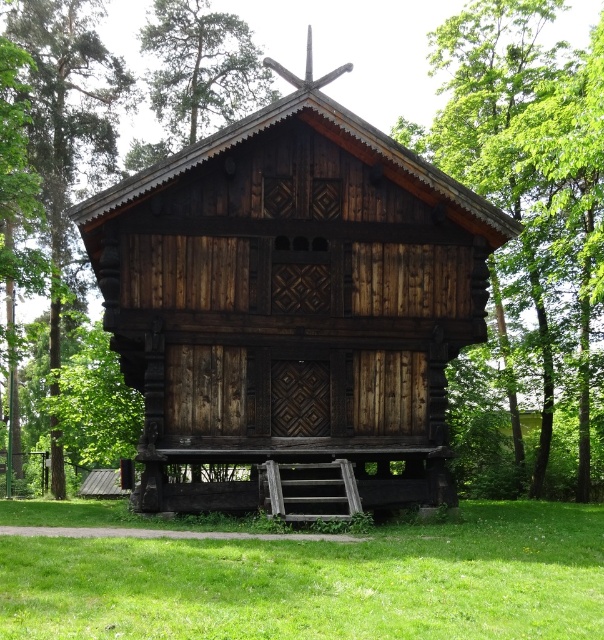
You are standing in front of the traditional wooden building and want to walk from the green wood tree at left to the green grass at lower center. Which direction should you move relative to the tree?

You should move to the right of the green wood tree at left because the green grass at lower center is positioned on the right side of the green wood tree at left.

You are standing in front of the traditional wooden building and want to place a picnic blanket on the green grass at lower center. However, you also notice the green wood tree at upper center. Which area is more suitable for placing the blanket based on their sizes?

The green grass at lower center is larger in size than the green wood tree at upper center, so it is more suitable for placing the picnic blanket because it has more space.